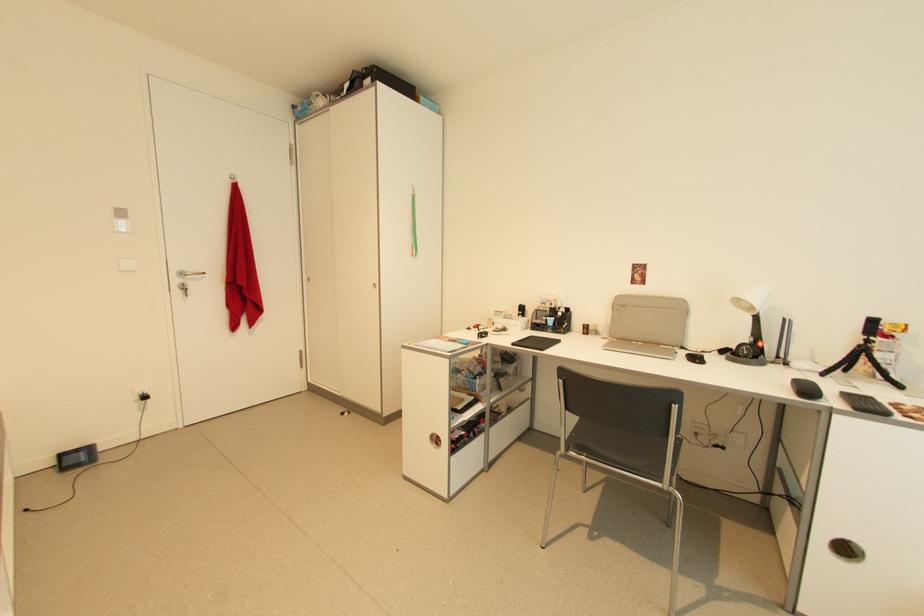
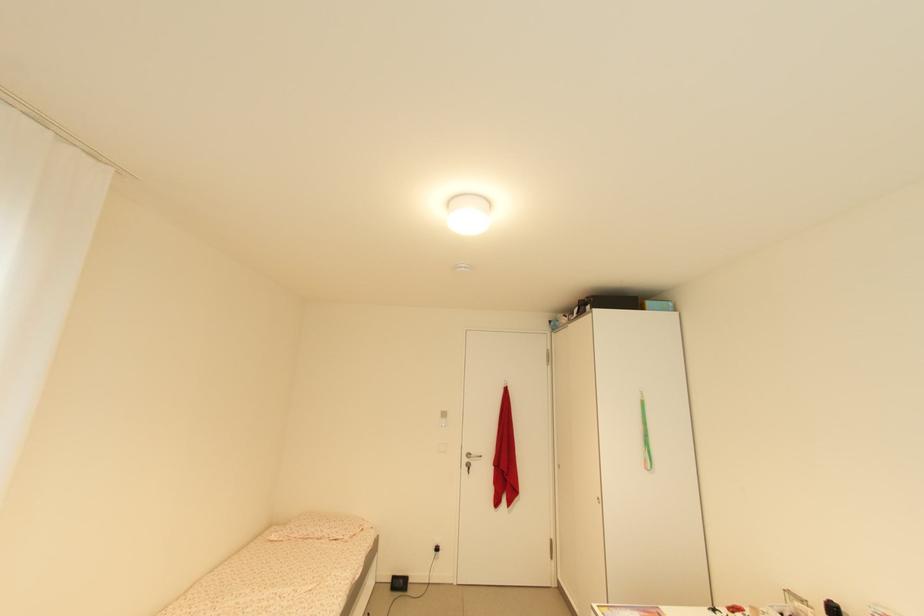
The point at (427,100) is marked in the first image. Where is the corresponding point in the second image?

(652, 304)